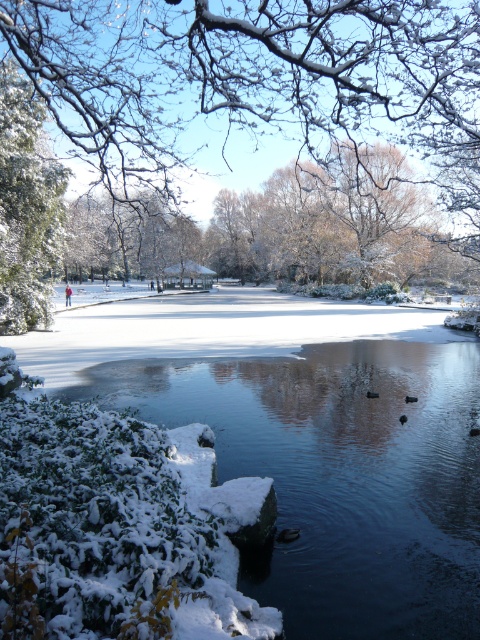
You are standing at the edge of the frozen lake in the winter scene. You notice a point marked at coordinates (256, 76). What object does this point indicate?

The point at coordinates (256, 76) indicates snow covered branches at upper center.